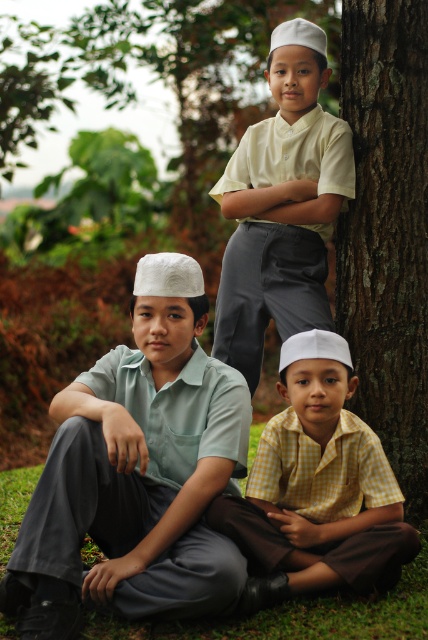
You are trying to decide which shirt to wear for a casual outdoor event. The matte green shirt at center and the yellow checkered shirt at lower center are both options. Based on the image, which shirt has a wider silhouette?

The matte green shirt at center might be wider than yellow checkered shirt at lower center according to the image.

You are trying to locate the matte green shirt at center in the image. According to the coordinates provided, where exactly is it positioned?

The matte green shirt at center is located at point 0.738 on the x axis and 0.322 on the y axis.